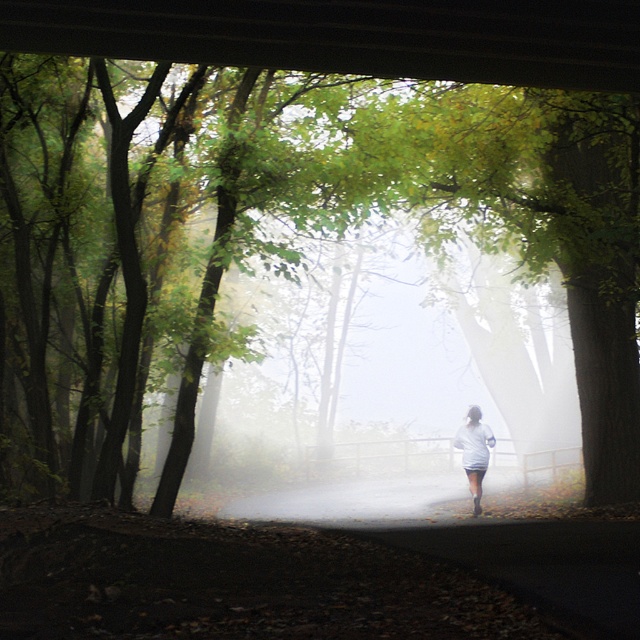
Question: Which of the following is the farthest from the observer?

Choices:
 (A) [481, 474]
 (B) [148, 157]

Answer: (A)

Question: Does green leafy tree at center come behind white matte shirt at center?

Choices:
 (A) no
 (B) yes

Answer: (A)

Question: Is green leafy tree at center above white matte shirt at center?

Choices:
 (A) yes
 (B) no

Answer: (A)

Question: Which object is closer to the camera taking this photo?

Choices:
 (A) green leafy tree at center
 (B) white matte shirt at center

Answer: (A)

Question: Is green leafy tree at center to the right of white matte shirt at center from the viewer's perspective?

Choices:
 (A) no
 (B) yes

Answer: (A)

Question: Which of the following is the closest to the observer?

Choices:
 (A) (481, 490)
 (B) (344, 198)

Answer: (B)